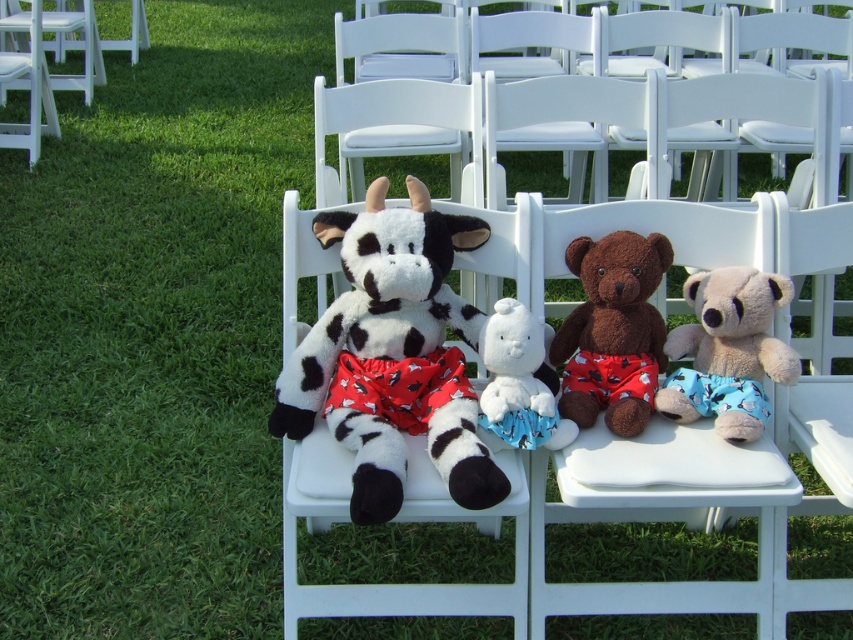
Question: Is brown plush teddy bear at center closer to the viewer compared to white plush rabbit at center?

Choices:
 (A) yes
 (B) no

Answer: (B)

Question: Among these points, which one is nearest to the camera?

Choices:
 (A) (548, 417)
 (B) (341, 352)
 (C) (643, 243)

Answer: (A)

Question: In this image, where is brown plush teddy bear at center located relative to white plush rabbit at center?

Choices:
 (A) above
 (B) below

Answer: (A)

Question: Can you confirm if fluffy blue teddy bear at center right is thinner than white wood chair at left?

Choices:
 (A) no
 (B) yes

Answer: (B)

Question: Which point is farther to the camera?

Choices:
 (A) (x=556, y=412)
 (B) (x=437, y=307)
 (C) (x=86, y=20)
 (D) (x=727, y=381)

Answer: (C)

Question: Which point is closer to the camera taking this photo?

Choices:
 (A) 540,440
 (B) 596,291
 (C) 447,243
 (D) 102,65

Answer: (A)